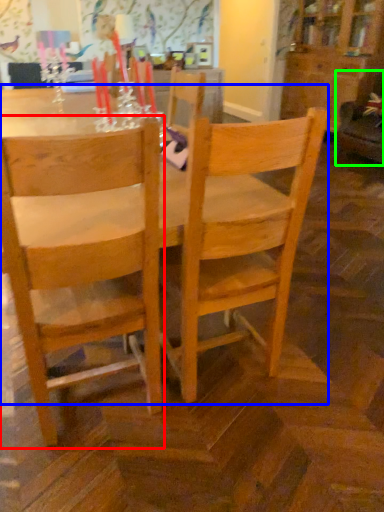
Question: Estimate the real-world distances between objects in this image. Which object is closer to chair (highlighted by a red box), kitchen & dining room table (highlighted by a blue box) or swivel chair (highlighted by a green box)?

Choices:
 (A) kitchen & dining room table
 (B) swivel chair

Answer: (A)